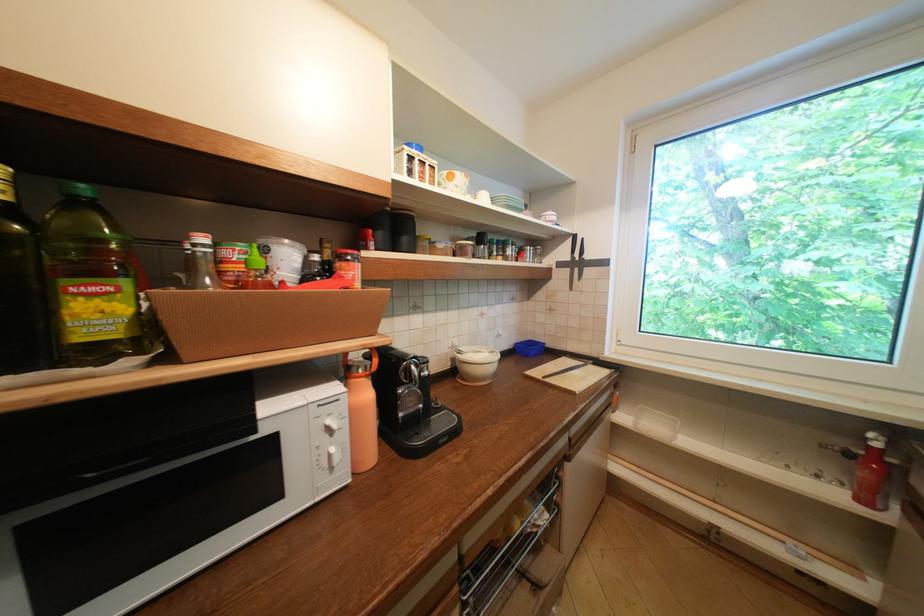
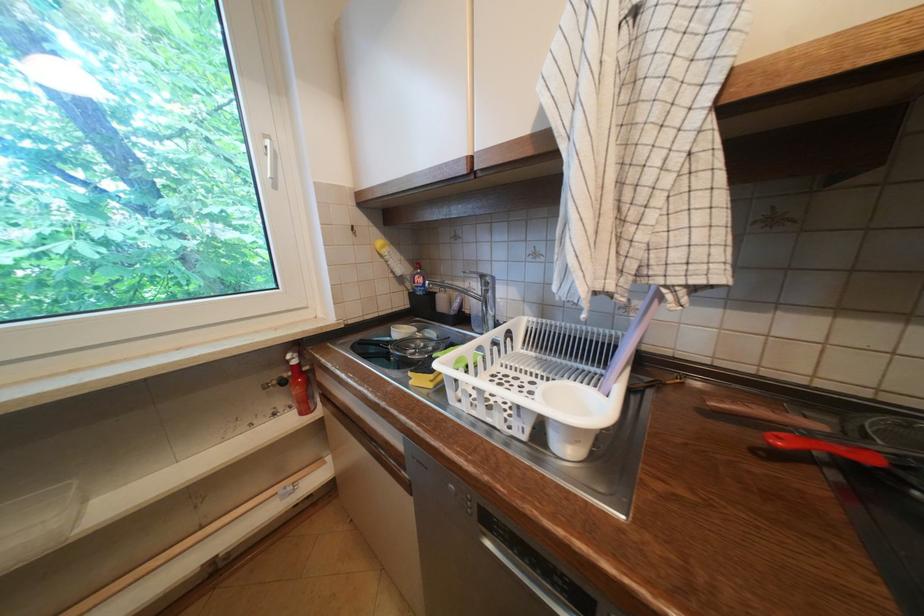
Question: The camera is either moving clockwise (left) or counter-clockwise (right) around the object. The first image is from the beginning of the video and the second image is from the end. Is the camera moving left or right when shooting the video?

Choices:
 (A) Left
 (B) Right

Answer: (A)